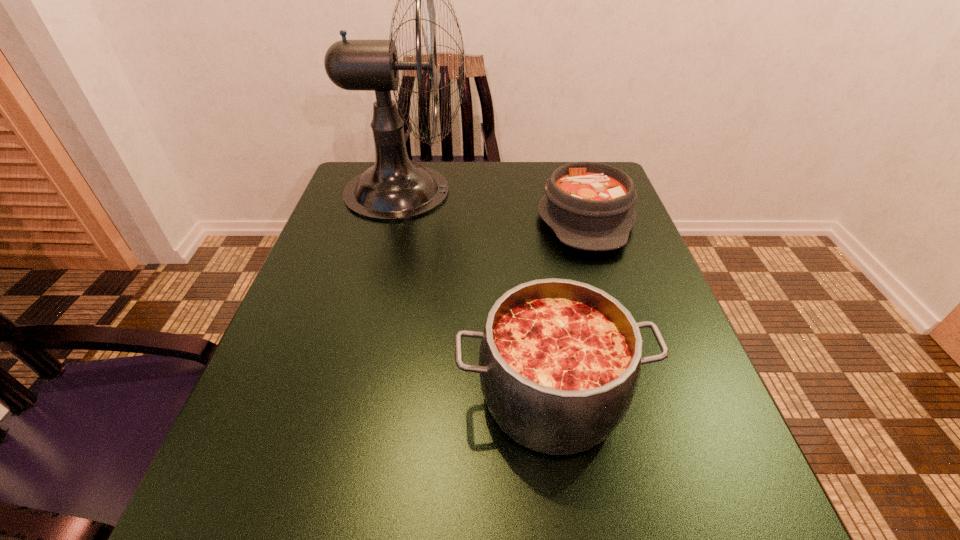
This screenshot has height=540, width=960. In order to click on vacant space that is in between the tallest object and the shortest object in this screenshot , I will do `click(495, 205)`.

The height and width of the screenshot is (540, 960). I want to click on free spot between the farther casserole and the tallest object, so click(495, 205).

Find the location of `blank region between the tallest object and the nearest object`. blank region between the tallest object and the nearest object is located at coordinates coord(478,293).

Image resolution: width=960 pixels, height=540 pixels. What are the coordinates of `free space between the nearer casserole and the fan` in the screenshot? It's located at (478, 293).

The image size is (960, 540). I want to click on empty space that is in between the fan and the nearest object, so click(478, 293).

Image resolution: width=960 pixels, height=540 pixels. In order to click on vacant space that's between the nearest object and the fan in this screenshot , I will do `click(478, 293)`.

The height and width of the screenshot is (540, 960). In order to click on vacant space that is in between the tallest object and the nearest object in this screenshot , I will do `click(478, 293)`.

The image size is (960, 540). I want to click on object that is the second nearest to the farther casserole, so [x=559, y=361].

The width and height of the screenshot is (960, 540). I want to click on object that ranks as the second closest to the taller casserole, so click(394, 188).

Locate an element on the screen. free region that satisfies the following two spatial constraints: 1. on the back side of the nearer casserole; 2. on the front-facing side of the tallest object is located at coordinates (523, 191).